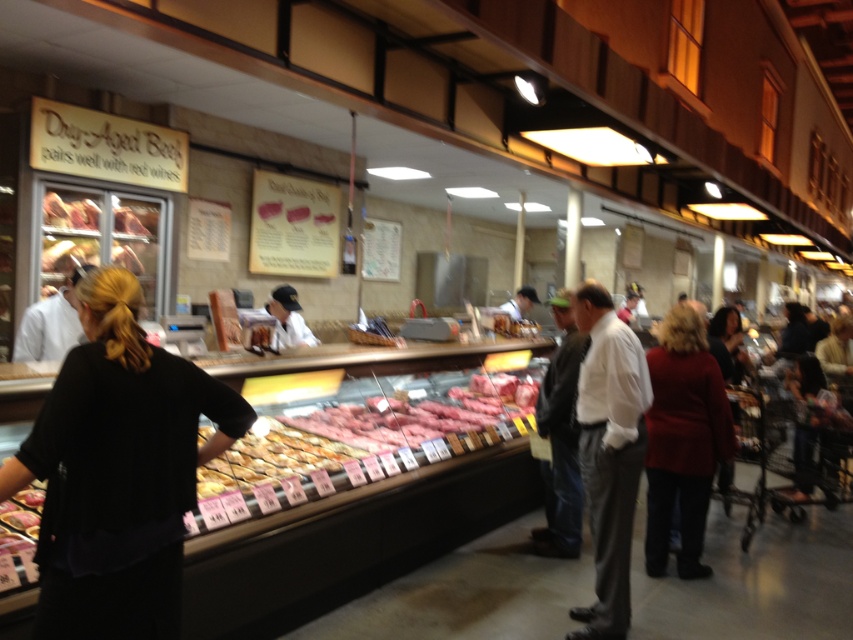
You are a customer standing at the entrance of the butchershop and want to grab the golden brown bread at center. Can you reach it without moving closer?

The golden brown bread at center is 3.05 meters from the camera, which is too far to reach without moving closer. You need to approach it to grab it.

You are a customer in the butchershop and want to know if the golden brown bread at center is taller than the white uniform at center. Can you determine this based on the scene?

The golden brown bread at center is not as tall as the white uniform at center.